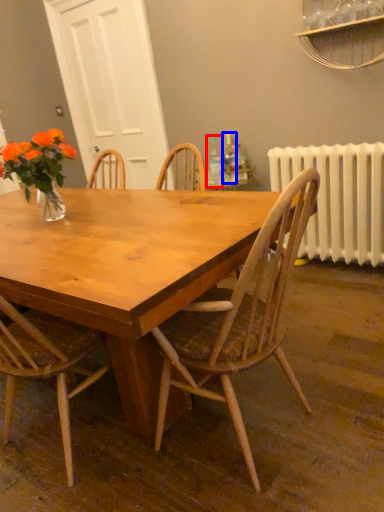
Question: Which object is closer to the camera taking this photo, bottle (highlighted by a red box) or bottle (highlighted by a blue box)?

Choices:
 (A) bottle
 (B) bottle

Answer: (A)